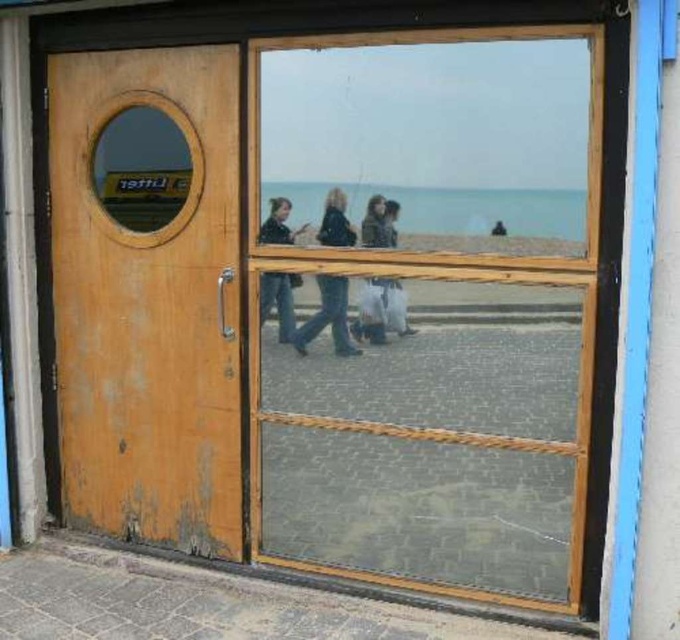
Does point (330, 420) come in front of point (277, 285)?

Yes, it is.

Does point (532, 81) come behind point (273, 208)?

No, it is in front of (273, 208).

This screenshot has width=680, height=640. In order to click on transparent glass door at center in this screenshot , I will do `click(432, 308)`.

Who is higher up, weathered wood door at left or dark blue jeans at center?

dark blue jeans at center is above.

Who is positioned more to the right, weathered wood door at left or dark blue jeans at center?

dark blue jeans at center is more to the right.

Describe the element at coordinates (148, 296) in the screenshot. I see `weathered wood door at left` at that location.

The height and width of the screenshot is (640, 680). I want to click on weathered wood door at left, so click(148, 296).

Does transparent glass door at center have a greater height compared to dark brown leather jacket at center?

Correct, transparent glass door at center is much taller as dark brown leather jacket at center.

Where is `transparent glass door at center`? The image size is (680, 640). transparent glass door at center is located at coordinates (432, 308).